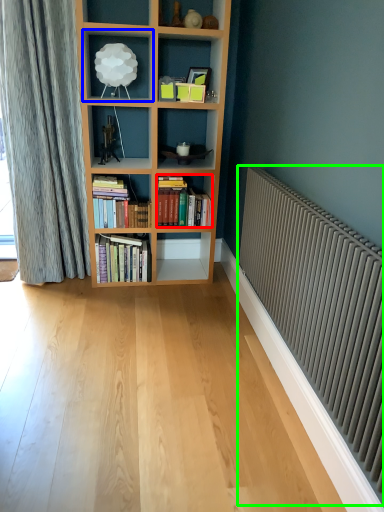
Question: Which object is positioned closest to book (highlighted by a red box)? Select from shelf (highlighted by a blue box) and radiator (highlighted by a green box).

Choices:
 (A) shelf
 (B) radiator

Answer: (A)